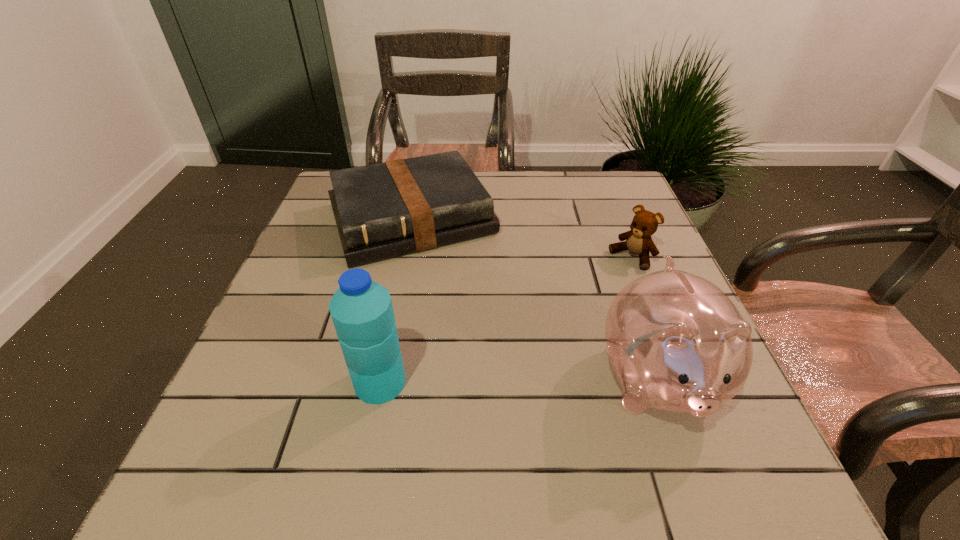
The width and height of the screenshot is (960, 540). Find the location of `water bottle`. water bottle is located at coordinates (362, 312).

You are a GUI agent. You are given a task and a screenshot of the screen. Output one action in this format:
    pyautogui.click(x=<x>, y=<y>)
    Task: Click on the piggy bank
    This screenshot has width=960, height=540.
    Given the screenshot: What is the action you would take?
    pyautogui.click(x=676, y=342)

This screenshot has width=960, height=540. Find the location of `teddy bear`. teddy bear is located at coordinates (638, 241).

The width and height of the screenshot is (960, 540). Identify the location of the shortest object. (385, 210).

Identify the location of free region located on the back of the water bottle. (396, 301).

Locate an element on the screen. The image size is (960, 540). free point located 0.050m on the front-facing side of the teddy bear is located at coordinates click(x=608, y=277).

Locate an element on the screen. free spot located on the front-facing side of the teddy bear is located at coordinates (539, 333).

The height and width of the screenshot is (540, 960). In order to click on free space located on the front-facing side of the teddy bear in this screenshot , I will do `click(600, 284)`.

The image size is (960, 540). I want to click on free space located on the spine side of the hardback book, so click(467, 323).

The width and height of the screenshot is (960, 540). Find the location of `vacant area situated on the spine side of the hardback book`. vacant area situated on the spine side of the hardback book is located at coordinates (481, 352).